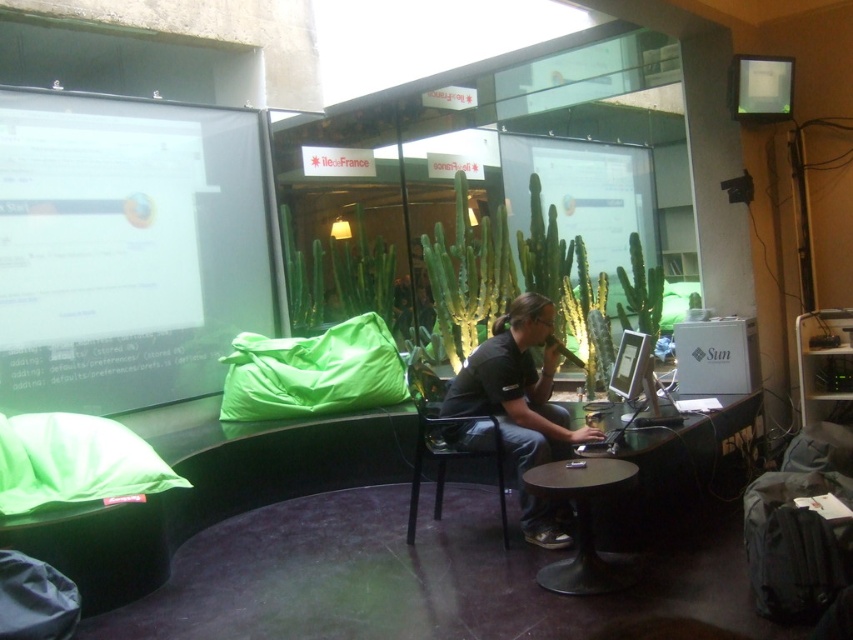
Question: Which point is farther to the camera?

Choices:
 (A) (587, 435)
 (B) (419, 480)
 (C) (543, 493)
 (D) (778, 92)

Answer: (D)

Question: Is matte white projection screen at left wider than metallic round table at center?

Choices:
 (A) yes
 (B) no

Answer: (A)

Question: Is black matte shirt at center above metallic round table at center?

Choices:
 (A) no
 (B) yes

Answer: (B)

Question: Based on their relative distances, which object is nearer to the matte white projection screen at left?

Choices:
 (A) metallic black chair at center
 (B) black matte shirt at center
 (C) matte white monitor at upper right

Answer: (A)

Question: Which of the following is the farthest from the observer?

Choices:
 (A) metallic black chair at center
 (B) matte white monitor at upper right
 (C) black matte shirt at center
 (D) matte white projection screen at left

Answer: (B)

Question: Does black matte shirt at center have a larger size compared to metallic black chair at center?

Choices:
 (A) yes
 (B) no

Answer: (A)